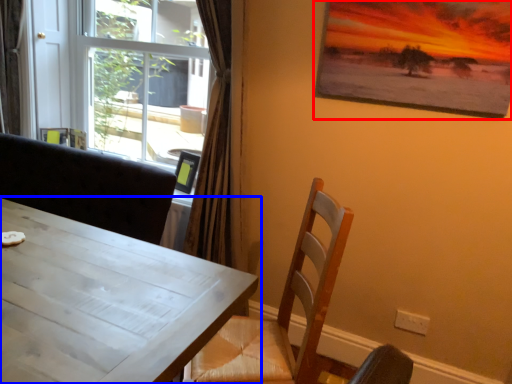
Question: Which of the following is the farthest to the observer, picture frame (highlighted by a red box) or table (highlighted by a blue box)?

Choices:
 (A) picture frame
 (B) table

Answer: (A)